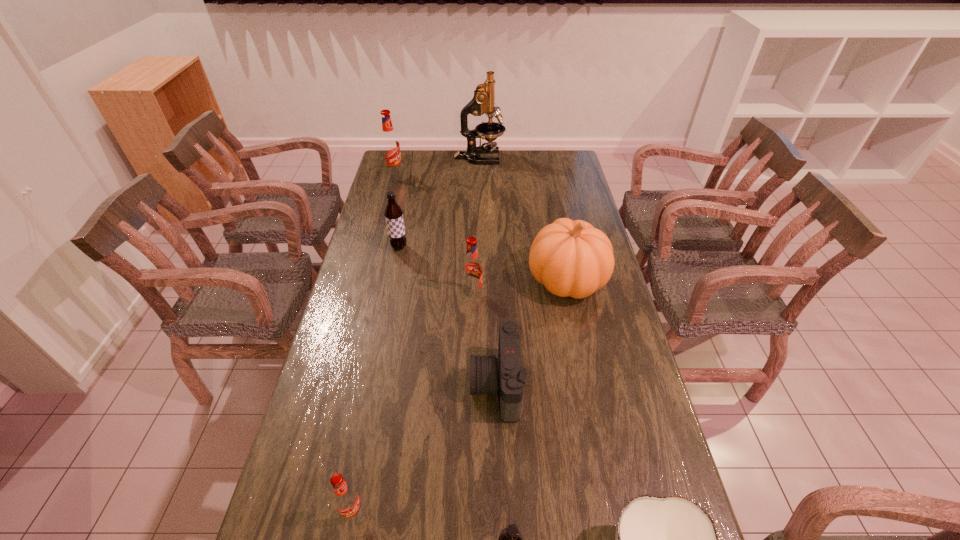
In order to click on free point located 0.130m at the lens of the camera in this screenshot , I will do `click(424, 385)`.

Identify the location of microscope that is at the far edge. (483, 102).

This screenshot has height=540, width=960. Identify the location of root beer present at the far edge. (390, 146).

This screenshot has width=960, height=540. Find the location of `object that is at the right edge`. object that is at the right edge is located at coordinates (571, 258).

Locate an element on the screen. The width and height of the screenshot is (960, 540). object present at the far left corner is located at coordinates (390, 146).

Image resolution: width=960 pixels, height=540 pixels. Find the location of `vacant space at the far edge`. vacant space at the far edge is located at coordinates (536, 171).

At what (x,y) coordinates should I click in order to perform the action: click on free region at the left edge of the desktop. Please return your answer as a coordinate pair (x, y). This screenshot has width=960, height=540. Looking at the image, I should click on (315, 396).

In the image, there is a desktop. At what (x,y) coordinates should I click in order to perform the action: click on vacant space at the right edge. Please return your answer as a coordinate pair (x, y). Looking at the image, I should click on (620, 381).

Identify the location of vacant area at the far right corner of the desktop. (551, 152).

Locate an element on the screen. This screenshot has height=540, width=960. vacant area that lies between the leftmost root beer and the pumpkin is located at coordinates (481, 227).